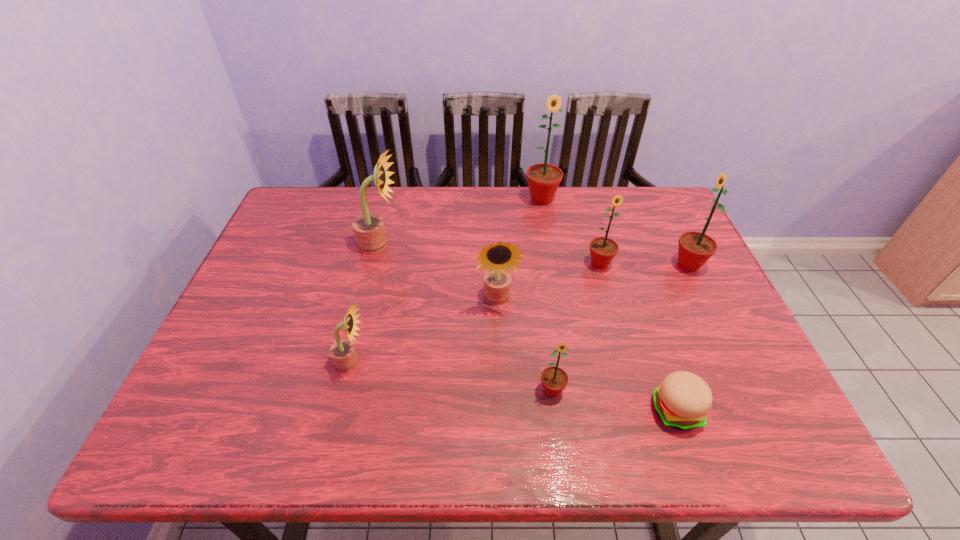
The height and width of the screenshot is (540, 960). I want to click on the farthest green sunflower, so click(543, 179).

Locate an element on the screen. the biggest green sunflower is located at coordinates (543, 179).

You are a GUI agent. You are given a task and a screenshot of the screen. Output one action in this format:
    pyautogui.click(x=<x>, y=<y>)
    Task: Click on the biggest yellow sunflower
    Image resolution: width=960 pixels, height=540 pixels.
    Given the screenshot: What is the action you would take?
    pyautogui.click(x=369, y=229)

You are a GUI agent. You are given a task and a screenshot of the screen. Output one action in this format:
    pyautogui.click(x=<x>, y=<y>)
    Task: Click on the rightmost sunflower
    Image resolution: width=960 pixels, height=540 pixels.
    Given the screenshot: What is the action you would take?
    pyautogui.click(x=695, y=248)

This screenshot has width=960, height=540. I want to click on the second biggest green sunflower, so click(x=695, y=248).

This screenshot has width=960, height=540. In order to click on the second sunflower from right to left in this screenshot , I will do `click(602, 249)`.

Locate an element on the screen. Image resolution: width=960 pixels, height=540 pixels. the third green sunflower from left to right is located at coordinates (602, 249).

Identify the location of the third nearest sunflower. (499, 257).

This screenshot has height=540, width=960. What are the coordinates of `the second farthest yellow sunflower` in the screenshot? It's located at (499, 257).

The image size is (960, 540). What are the coordinates of `the sixth farthest object` in the screenshot? It's located at (342, 352).